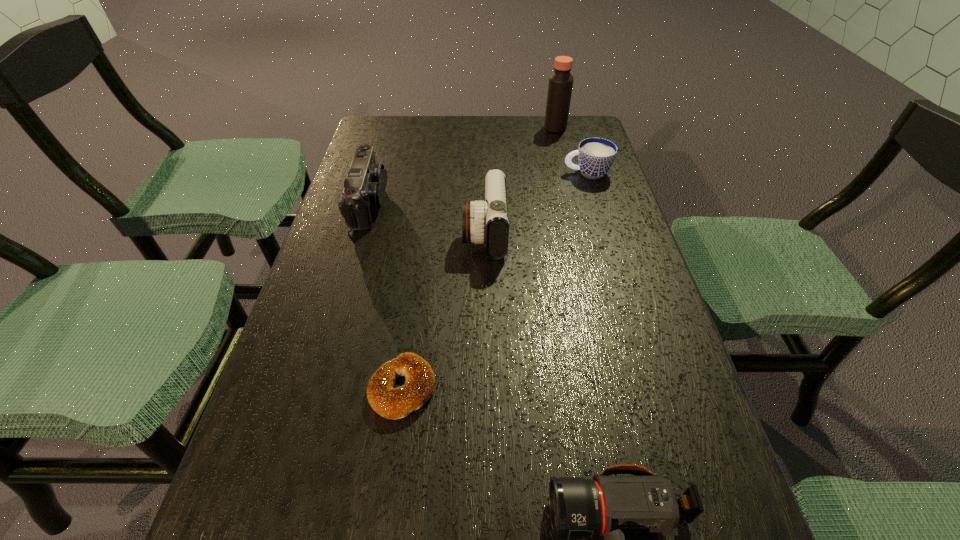
The image size is (960, 540). I want to click on object present at the far right corner, so click(560, 86).

Where is `vacant position at the far edge of the desktop`? The width and height of the screenshot is (960, 540). vacant position at the far edge of the desktop is located at coordinates (519, 123).

Find the location of a particular element. This screenshot has height=540, width=960. vacant space at the left edge of the desktop is located at coordinates (292, 336).

Image resolution: width=960 pixels, height=540 pixels. In the image, there is a desktop. Identify the location of vacant space at the right edge. (637, 400).

Locate an element on the screen. vacant space at the far right corner is located at coordinates (583, 137).

In order to click on vacant area that lies between the leftmost object and the fourth object from right to left in this screenshot , I will do `click(427, 218)`.

You are a GUI agent. You are given a task and a screenshot of the screen. Output one action in this format:
    pyautogui.click(x=<x>, y=<y>)
    Task: Click on the vacant space in between the leftmost camcorder and the second camcorder from right to left
    
    Given the screenshot: What is the action you would take?
    pyautogui.click(x=427, y=218)

Locate an element on the screen. The width and height of the screenshot is (960, 540). blank region between the second nearest object and the cup is located at coordinates (494, 280).

The height and width of the screenshot is (540, 960). Identify the location of vacant area that lies between the second camcorder from right to left and the farthest object. (520, 180).

Image resolution: width=960 pixels, height=540 pixels. I want to click on free area in between the leftmost object and the fifth farthest object, so click(386, 296).